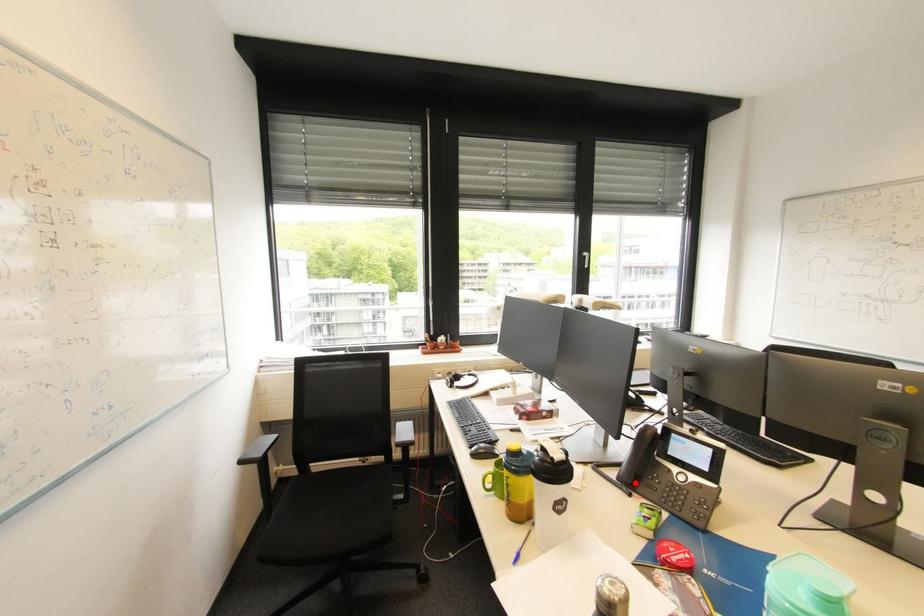
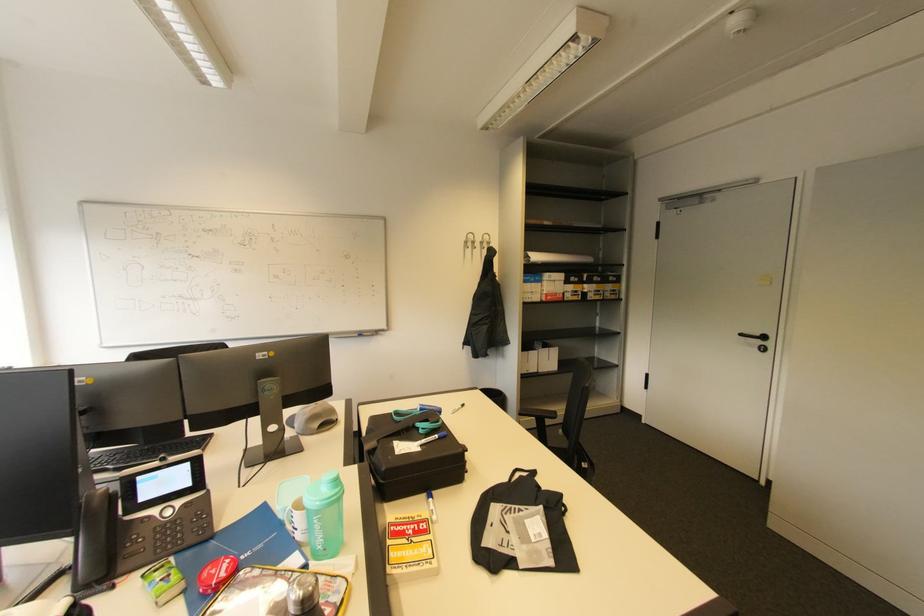
Where in the second image is the point corresponding to the highlighted location from the first image?

(107, 575)